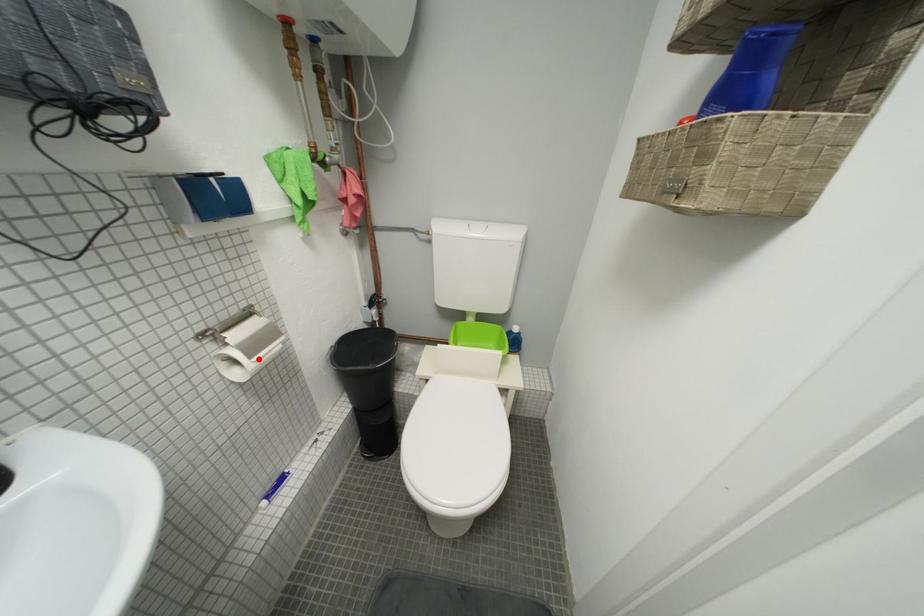
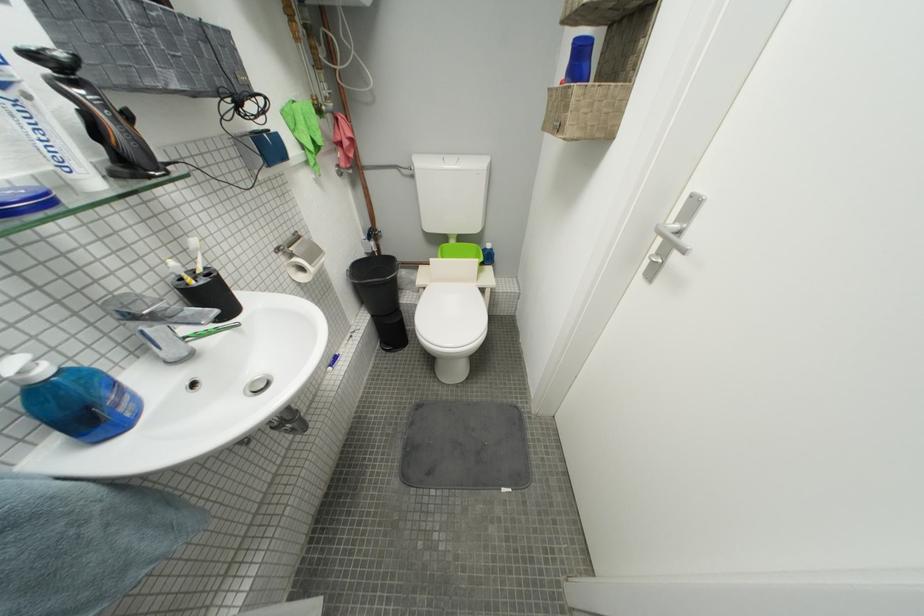
Where in the second image is the point corresponding to the highlighted location from the first image?

(320, 265)